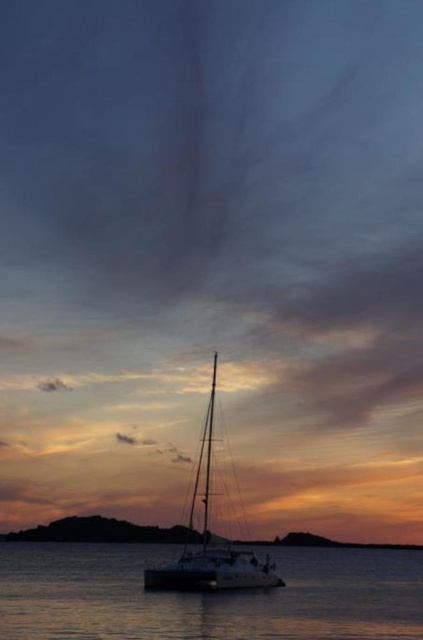
Question: Can you confirm if silvery reflective water at lower center is positioned to the left of smooth sand at lower center?

Choices:
 (A) yes
 (B) no

Answer: (A)

Question: Which point is farther to the camera?

Choices:
 (A) silvery reflective water at lower center
 (B) smooth sand at lower center

Answer: (B)

Question: Among these objects, which one is nearest to the camera?

Choices:
 (A) silvery reflective water at lower center
 (B) satin white sailboat at center
 (C) smooth sand at lower center

Answer: (A)

Question: Can you confirm if silvery reflective water at lower center is positioned to the right of satin white sailboat at center?

Choices:
 (A) no
 (B) yes

Answer: (A)

Question: Is the position of silvery reflective water at lower center more distant than that of smooth sand at lower center?

Choices:
 (A) no
 (B) yes

Answer: (A)

Question: Considering the real-world distances, which object is farthest from the smooth sand at lower center?

Choices:
 (A) satin white sailboat at center
 (B) silvery reflective water at lower center

Answer: (A)